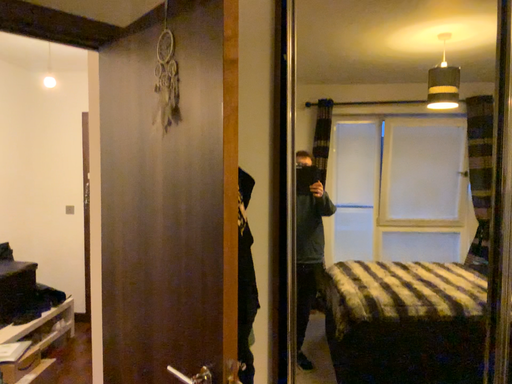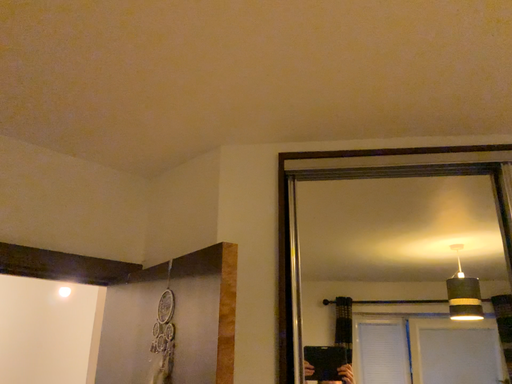
Question: How did the camera likely rotate when shooting the video?

Choices:
 (A) rotated upward
 (B) rotated downward

Answer: (A)